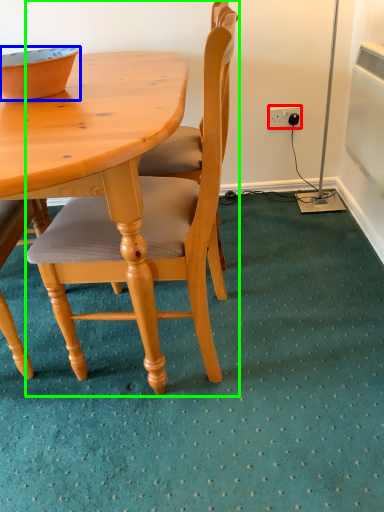
Question: Which is nearer to the power outlet (highlighted by a red box)? bowl (highlighted by a blue box) or chair (highlighted by a green box).

Choices:
 (A) bowl
 (B) chair

Answer: (B)